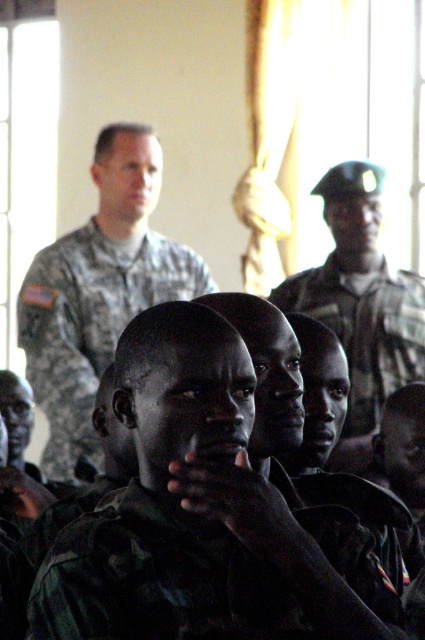
Question: Can you confirm if camouflage uniform at upper center is positioned below camouflage uniform at center?

Choices:
 (A) no
 (B) yes

Answer: (A)

Question: Which point is farther to the camera?

Choices:
 (A) camouflage uniform at center
 (B) camouflage uniform at upper center

Answer: (B)

Question: Which object is the closest to the green camouflage uniform at center?

Choices:
 (A) camouflage uniform at center
 (B) camouflage uniform at upper center

Answer: (A)

Question: Does green camouflage uniform at center appear on the left side of camouflage uniform at center?

Choices:
 (A) no
 (B) yes

Answer: (B)

Question: Is green camouflage uniform at center to the right of camouflage uniform at upper center from the viewer's perspective?

Choices:
 (A) yes
 (B) no

Answer: (A)

Question: Which object is closer to the camera taking this photo?

Choices:
 (A) camouflage uniform at upper center
 (B) green camouflage uniform at center
 (C) camouflage uniform at center

Answer: (B)